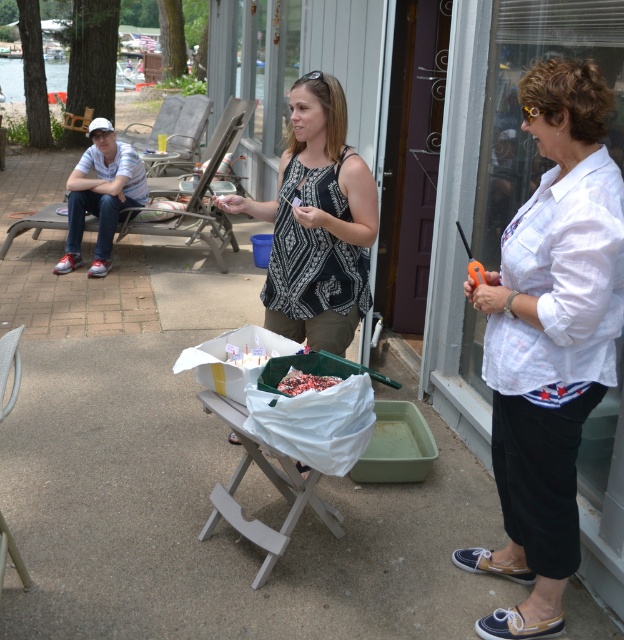
You are a photographer positioned at the edge of the patio, wanting to take a photo of the patterned fabric tank top at center and the chocolate cake at center. Which object should you focus on first to ensure both are in focus?

The patterned fabric tank top at center is closer to you than the chocolate cake at center, so focus on it first to ensure both are in focus.

You are a photographer planning to take a group photo of the people at the lakeside. You want to ensure that the white cotton shirt at center and the chocolate cake at center are both clearly visible in the shot. Considering their sizes, which one should you focus on first to ensure proper focus?

The white cotton shirt at center is taller than the chocolate cake at center, so you should focus on the white cotton shirt at center first to ensure proper focus.